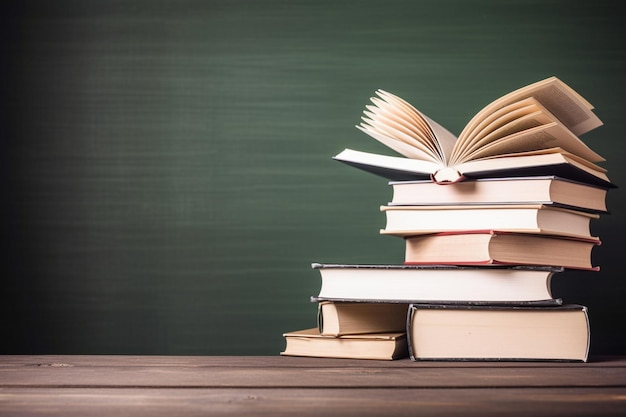
Locate an element on the screen. This screenshot has height=417, width=626. closed books is located at coordinates [364, 340], [374, 318], [461, 340], [478, 292], [481, 248], [483, 221], [496, 195].